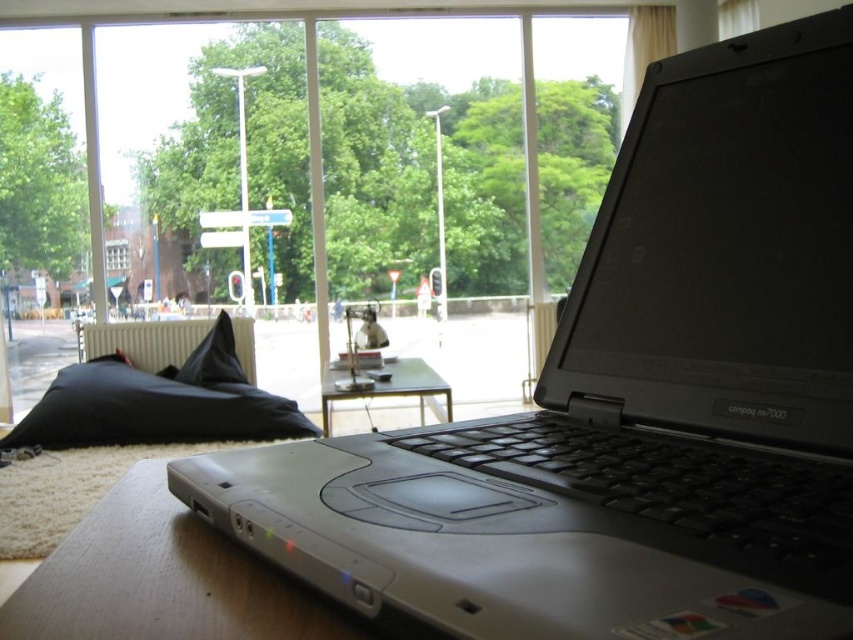
Is clear glass table at center behind black fabric pillow at center?

That is False.

Does clear glass table at center have a smaller size compared to black fabric pillow at center?

Answer: No, clear glass table at center is not smaller than black fabric pillow at center.

This screenshot has height=640, width=853. What do you see at coordinates (387, 387) in the screenshot? I see `clear glass table at center` at bounding box center [387, 387].

The image size is (853, 640). In order to click on clear glass table at center in this screenshot , I will do `click(387, 387)`.

Between transparent glass window at center and black fabric pillow at left, which one appears on the left side from the viewer's perspective?

From the viewer's perspective, black fabric pillow at left appears more on the left side.

Is transparent glass window at center above black fabric pillow at left?

Yes.

At what (x,y) coordinates should I click in order to perform the action: click on transparent glass window at center. Please return your answer as a coordinate pair (x, y). The image size is (853, 640). Looking at the image, I should click on (361, 177).

Can you confirm if transparent glass window at center is bigger than black fabric pillow at center?

Yes.

Does transparent glass window at center lie behind black fabric pillow at center?

Yes, it is.

Identify the location of transparent glass window at center. (361, 177).